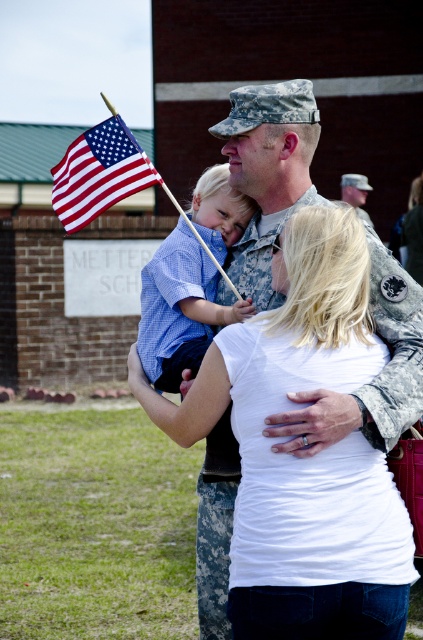
You are a photographer standing at the camera position. You want to capture a closeup shot of the checkered shirt at center. Given that your camera can focus on objects within 5 meters, will you be able to take the closeup?

The checkered shirt at center is 5.70 meters away from the camera. Since the camera can only focus within 5 meters, you will not be able to take the closeup as the distance exceeds the focus range.

In the scene shown: You are a photographer at the event and want to ensure both the checkered shirt at center and the camouflage uniform at center are clearly visible in the photo. Given their widths, which object should you focus on to capture more details without cropping?

The checkered shirt at center has a greater width than the camouflage uniform at center, so focusing on the checkered shirt at center will allow you to capture more details without cropping.